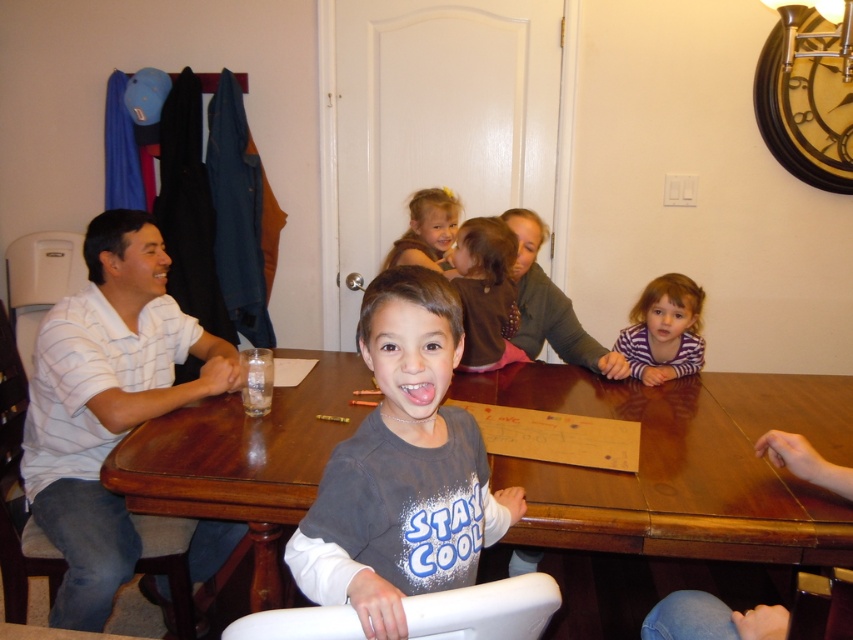
Question: Which point is farther to the camera?

Choices:
 (A) [434, 252]
 (B) [381, 349]
 (C) [677, 339]
 (D) [109, 396]

Answer: (A)

Question: Which of the following is the farthest from the observer?

Choices:
 (A) white striped shirt at left
 (B) brown wooden table at center
 (C) gray cotton shirt at center

Answer: (A)

Question: Can you confirm if gray cotton shirt at center is positioned to the left of pink glossy tongue at center?

Choices:
 (A) no
 (B) yes

Answer: (A)

Question: Which of these objects is positioned closest to the brown wooden table at center?

Choices:
 (A) brown fuzzy sweater at center
 (B) purple striped shirt at lower right
 (C) pink glossy tongue at center
 (D) white striped shirt at left

Answer: (B)

Question: Is brown wooden table at center thinner than brown fuzzy sweater at center?

Choices:
 (A) no
 (B) yes

Answer: (A)

Question: Can you confirm if purple striped shirt at lower right is thinner than pink glossy tongue at center?

Choices:
 (A) yes
 (B) no

Answer: (B)